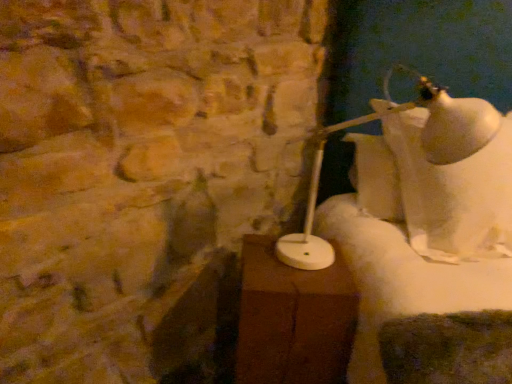
Question: From the image's perspective, is brown wood table at center above or below white glossy lamp at right?

Choices:
 (A) below
 (B) above

Answer: (A)

Question: Considering the positions of brown wood table at center and white glossy lamp at right in the image, is brown wood table at center taller or shorter than white glossy lamp at right?

Choices:
 (A) short
 (B) tall

Answer: (A)

Question: Would you say brown wood table at center is to the left or to the right of white glossy lamp at right in the picture?

Choices:
 (A) right
 (B) left

Answer: (B)

Question: From a real-world perspective, is white glossy lamp at right physically located above or below brown wood table at center?

Choices:
 (A) below
 (B) above

Answer: (B)

Question: Is white glossy lamp at right inside or outside of brown wood table at center?

Choices:
 (A) inside
 (B) outside

Answer: (B)

Question: From the image's perspective, relative to brown wood table at center, is white glossy lamp at right above or below?

Choices:
 (A) below
 (B) above

Answer: (B)

Question: Is white glossy lamp at right wider or thinner than brown wood table at center?

Choices:
 (A) thin
 (B) wide

Answer: (B)